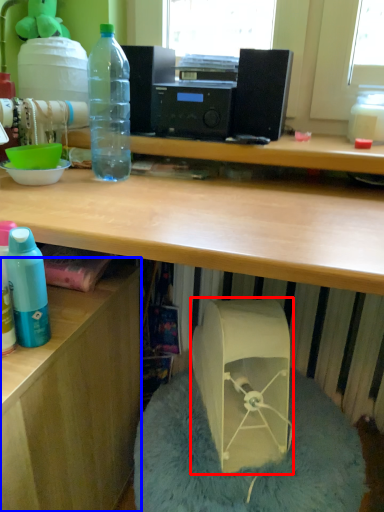
Question: Among these objects, which one is farthest to the camera, wide (highlighted by a red box) or desk (highlighted by a blue box)?

Choices:
 (A) wide
 (B) desk

Answer: (A)